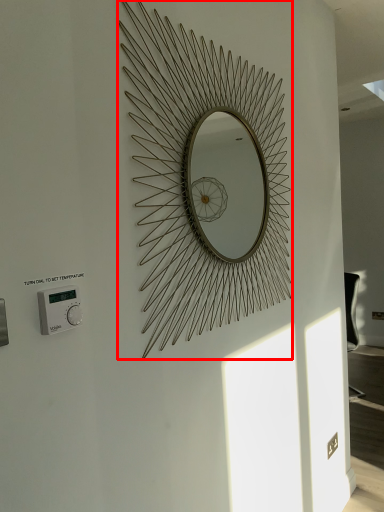
Question: From the image's perspective, what is the correct spatial relationship of oval (annotated by the red box) in relation to thermostat?

Choices:
 (A) above
 (B) below

Answer: (A)